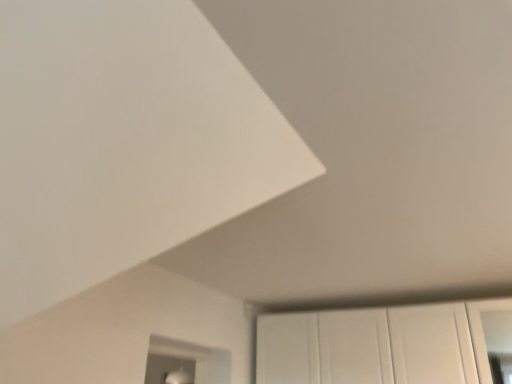
The image size is (512, 384). I want to click on white matte exhaust hood at upper center, so click(123, 142).

What do you see at coordinates (123, 142) in the screenshot? I see `white matte exhaust hood at upper center` at bounding box center [123, 142].

Identify the location of white matte exhaust hood at upper center. The height and width of the screenshot is (384, 512). (123, 142).